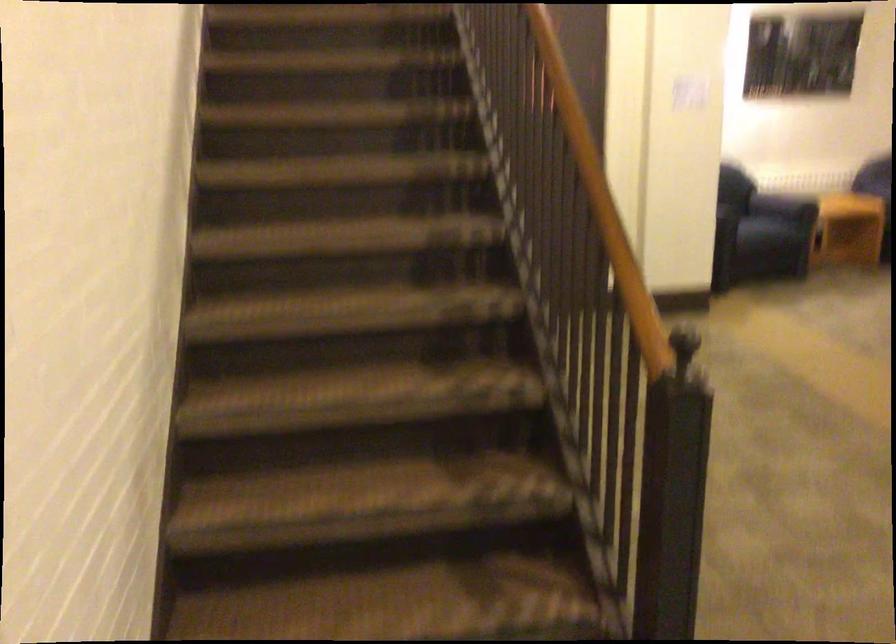
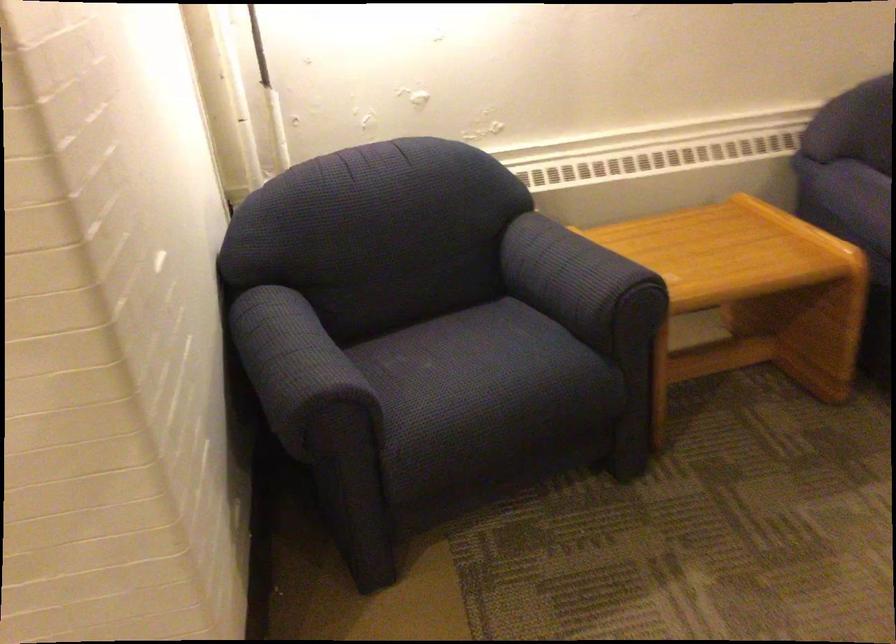
Locate, in the second image, the point that corresponds to [810,190] in the first image.

(579, 281)